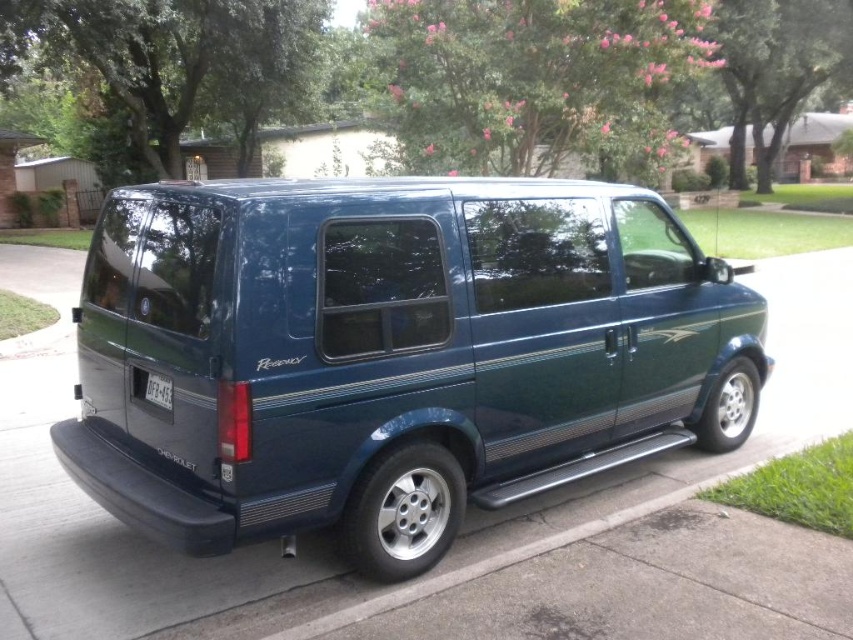
Question: Which point is farther to the camera?

Choices:
 (A) (397, 262)
 (B) (161, 401)

Answer: (A)

Question: Is metallic blue van at center below white plastic license plate at lower center?

Choices:
 (A) no
 (B) yes

Answer: (A)

Question: Can you confirm if metallic blue van at center is bigger than white plastic license plate at lower center?

Choices:
 (A) no
 (B) yes

Answer: (B)

Question: Which object appears farthest from the camera in this image?

Choices:
 (A) metallic blue van at center
 (B) white plastic license plate at lower center

Answer: (B)

Question: Is metallic blue van at center smaller than white plastic license plate at lower center?

Choices:
 (A) no
 (B) yes

Answer: (A)

Question: Among these points, which one is nearest to the camera?

Choices:
 (A) (384, 486)
 (B) (157, 404)

Answer: (B)